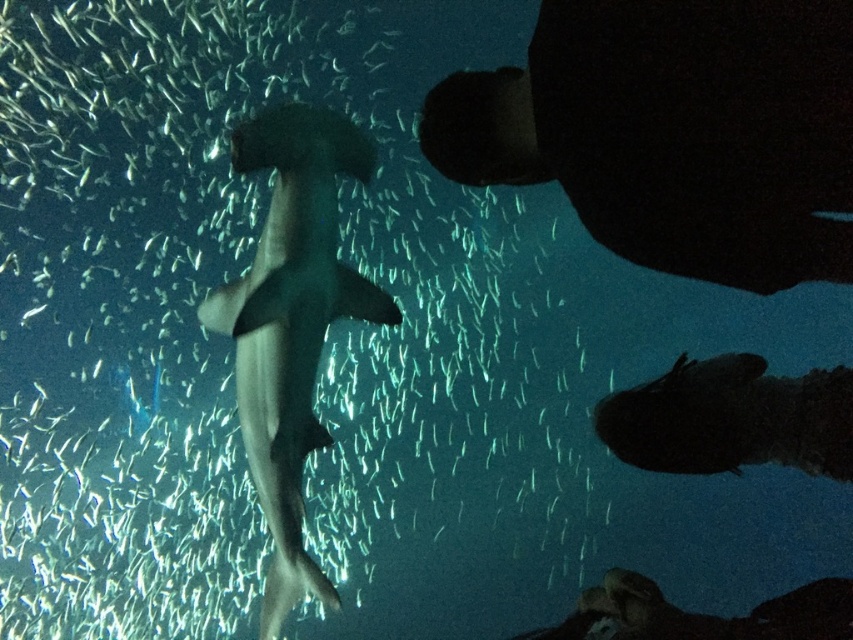
Question: Which point appears closest to the camera in this image?

Choices:
 (A) (178, 490)
 (B) (251, 412)
 (C) (850, 276)

Answer: (C)

Question: Which of the following is the farthest from the observer?

Choices:
 (A) (71, 131)
 (B) (318, 193)

Answer: (A)

Question: Observing the image, what is the correct spatial positioning of translucent gray shark at center in reference to black matte diver at upper center?

Choices:
 (A) above
 (B) below

Answer: (B)

Question: Does black matte diver at upper center lie in front of gray matte shark at center?

Choices:
 (A) no
 (B) yes

Answer: (B)

Question: Does black matte diver at upper center lie behind gray matte shark at center?

Choices:
 (A) yes
 (B) no

Answer: (B)

Question: Which point is farther to the camera?

Choices:
 (A) gray matte shark at center
 (B) black matte diver at upper center
 (C) translucent gray shark at center

Answer: (C)